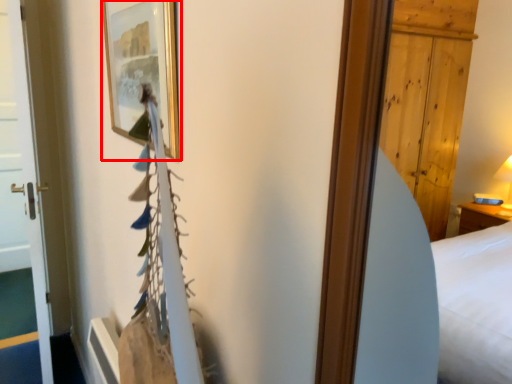
Question: Considering the relative positions of picture frame (annotated by the red box) and door in the image provided, where is picture frame (annotated by the red box) located with respect to the staircase?

Choices:
 (A) left
 (B) right

Answer: (B)